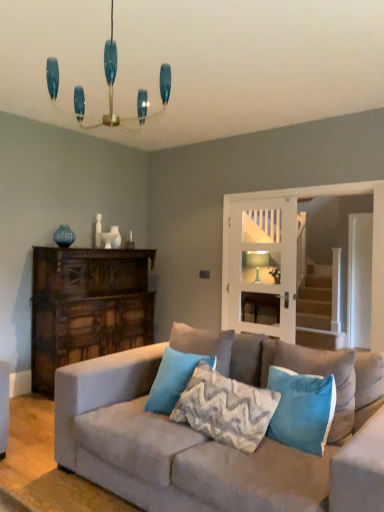
Question: Is textured gray pillow at center, the second pillow viewed from the right, placed right next to suede couch at center?

Choices:
 (A) yes
 (B) no

Answer: (B)

Question: Does textured gray pillow at center, the second pillow viewed from the right, have a lesser height compared to suede couch at center?

Choices:
 (A) yes
 (B) no

Answer: (A)

Question: Is suede couch at center completely or partially inside textured gray pillow at center, marked as the 3th pillow in a left-to-right arrangement?

Choices:
 (A) yes
 (B) no

Answer: (B)

Question: From the image's perspective, is textured gray pillow at center, marked as the 3th pillow in a left-to-right arrangement, on suede couch at center?

Choices:
 (A) yes
 (B) no

Answer: (A)

Question: Considering the relative sizes of textured gray pillow at center, marked as the 3th pillow in a left-to-right arrangement, and suede couch at center in the image provided, is textured gray pillow at center, marked as the 3th pillow in a left-to-right arrangement, wider than suede couch at center?

Choices:
 (A) no
 (B) yes

Answer: (A)

Question: From the image's perspective, is white glass door at center positioned above or below teal velvet pillow at center, marked as the 1th pillow in a left-to-right arrangement?

Choices:
 (A) below
 (B) above

Answer: (B)

Question: In terms of size, does white glass door at center appear bigger or smaller than teal velvet pillow at center, marked as the 1th pillow in a left-to-right arrangement?

Choices:
 (A) small
 (B) big

Answer: (B)

Question: Which is correct: white glass door at center is inside teal velvet pillow at center, marked as the 1th pillow in a left-to-right arrangement, or outside of it?

Choices:
 (A) outside
 (B) inside

Answer: (A)

Question: From a real-world perspective, relative to teal velvet pillow at center, marked as the 1th pillow in a left-to-right arrangement, is white glass door at center vertically above or below?

Choices:
 (A) below
 (B) above

Answer: (B)

Question: Choose the correct answer: Is white glass door at center inside teal glass chandelier at upper center or outside it?

Choices:
 (A) outside
 (B) inside

Answer: (A)

Question: From a real-world perspective, relative to teal glass chandelier at upper center, is white glass door at center vertically above or below?

Choices:
 (A) below
 (B) above

Answer: (A)

Question: Considering their positions, is white glass door at center located in front of or behind teal glass chandelier at upper center?

Choices:
 (A) behind
 (B) front

Answer: (A)

Question: Is white glass door at center bigger or smaller than teal glass chandelier at upper center?

Choices:
 (A) small
 (B) big

Answer: (A)

Question: Choose the correct answer: Is teal velvet pillow at center, marked as the 1th pillow in a left-to-right arrangement, inside suede couch at center or outside it?

Choices:
 (A) inside
 (B) outside

Answer: (A)

Question: Relative to suede couch at center, is teal velvet pillow at center, which appears as the 4th pillow when viewed from the right, in front or behind?

Choices:
 (A) behind
 (B) front

Answer: (A)